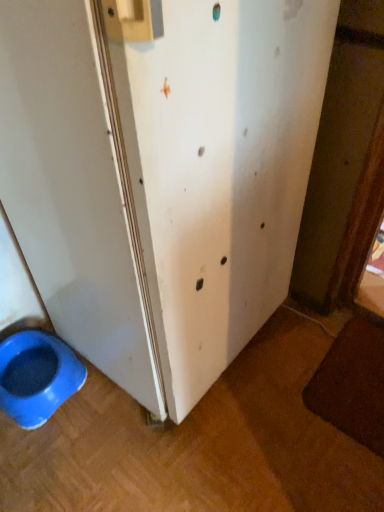
Describe the element at coordinates (37, 377) in the screenshot. This screenshot has height=512, width=384. I see `blue plastic bowl at lower left` at that location.

You are a GUI agent. You are given a task and a screenshot of the screen. Output one action in this format:
    pyautogui.click(x=<x>, y=<y>)
    Task: Click on the blue plastic bowl at lower left
    The image size is (384, 512).
    Given the screenshot: What is the action you would take?
    pyautogui.click(x=37, y=377)

Image resolution: width=384 pixels, height=512 pixels. I want to click on white matte screen door at lower left, so click(213, 166).

In order to face white matte screen door at lower left, should I rotate leftwards or rightwards?

Rotate left and turn 4.479 degrees.

Describe the element at coordinates (213, 166) in the screenshot. I see `white matte screen door at lower left` at that location.

Where is `blue plastic bowl at lower left`? blue plastic bowl at lower left is located at coordinates (37, 377).

Considering the relative positions of white matte screen door at lower left and blue plastic bowl at lower left in the image provided, is white matte screen door at lower left to the right of blue plastic bowl at lower left from the viewer's perspective?

Yes, white matte screen door at lower left is to the right of blue plastic bowl at lower left.

Is white matte screen door at lower left in front of or behind blue plastic bowl at lower left in the image?

Visually, white matte screen door at lower left is located in front of blue plastic bowl at lower left.

Which is closer to the camera, (258, 297) or (69, 376)?

Point (258, 297)

From the image's perspective, is white matte screen door at lower left located above blue plastic bowl at lower left?

Yes.

From a real-world perspective, is white matte screen door at lower left positioned under blue plastic bowl at lower left based on gravity?

No, from a real-world perspective, white matte screen door at lower left is not under blue plastic bowl at lower left.

Considering the sizes of white matte screen door at lower left and blue plastic bowl at lower left in the image, is white matte screen door at lower left wider or thinner than blue plastic bowl at lower left?

Clearly, white matte screen door at lower left has more width compared to blue plastic bowl at lower left.

Who is shorter, white matte screen door at lower left or blue plastic bowl at lower left?

With less height is blue plastic bowl at lower left.

Is white matte screen door at lower left bigger or smaller than blue plastic bowl at lower left?

Clearly, white matte screen door at lower left is larger in size than blue plastic bowl at lower left.

Based on the photo, is white matte screen door at lower left positioned beyond the bounds of blue plastic bowl at lower left?

white matte screen door at lower left lies outside blue plastic bowl at lower left's area.

Is white matte screen door at lower left touching blue plastic bowl at lower left?

white matte screen door at lower left and blue plastic bowl at lower left are clearly separated.

Is white matte screen door at lower left looking in the opposite direction of blue plastic bowl at lower left?

No, white matte screen door at lower left is not facing away from blue plastic bowl at lower left.

The width and height of the screenshot is (384, 512). I want to click on screen door in front of the blue plastic bowl at lower left, so click(x=213, y=166).

Does blue plastic bowl at lower left appear on the right side of white matte screen door at lower left?

In fact, blue plastic bowl at lower left is to the left of white matte screen door at lower left.

Is the position of blue plastic bowl at lower left more distant than that of white matte screen door at lower left?

Yes.

Which is closer, (41, 385) or (283, 9)?

Result: The point (283, 9) is in front.

From the image's perspective, is blue plastic bowl at lower left above or below white matte screen door at lower left?

blue plastic bowl at lower left is below white matte screen door at lower left.

From a real-world perspective, which object rests below the other?

In real-world perspective, blue plastic bowl at lower left is lower.

Which of these two, blue plastic bowl at lower left or white matte screen door at lower left, is wider?

white matte screen door at lower left.

Between blue plastic bowl at lower left and white matte screen door at lower left, which one has less height?

blue plastic bowl at lower left.

Is blue plastic bowl at lower left smaller than white matte screen door at lower left?

Indeed, blue plastic bowl at lower left has a smaller size compared to white matte screen door at lower left.

Looking at this image, is blue plastic bowl at lower left inside the boundaries of white matte screen door at lower left, or outside?

blue plastic bowl at lower left is not enclosed by white matte screen door at lower left.

Looking at this image, does blue plastic bowl at lower left touch white matte screen door at lower left?

blue plastic bowl at lower left is not next to white matte screen door at lower left, and they're not touching.

Is blue plastic bowl at lower left oriented away from white matte screen door at lower left?

blue plastic bowl at lower left is not turned away from white matte screen door at lower left.

Locate an element on the screen. This screenshot has height=512, width=384. toilet located underneath the white matte screen door at lower left (from a real-world perspective) is located at coordinates (37, 377).

The height and width of the screenshot is (512, 384). I want to click on toilet behind the white matte screen door at lower left, so click(x=37, y=377).

The height and width of the screenshot is (512, 384). Find the location of `screen door above the blue plastic bowl at lower left (from a real-world perspective)`. screen door above the blue plastic bowl at lower left (from a real-world perspective) is located at coordinates (213, 166).